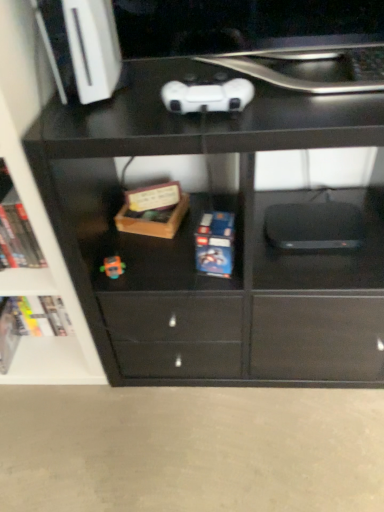
Find the location of a particular element. This screenshot has height=512, width=384. vacant space to the left of black matte laptop keyboard at upper center is located at coordinates (321, 83).